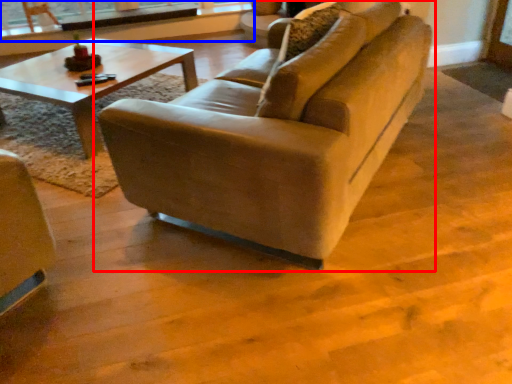
Question: Which point is closer to the camera, studio couch (highlighted by a red box) or window frame (highlighted by a blue box)?

Choices:
 (A) studio couch
 (B) window frame

Answer: (A)